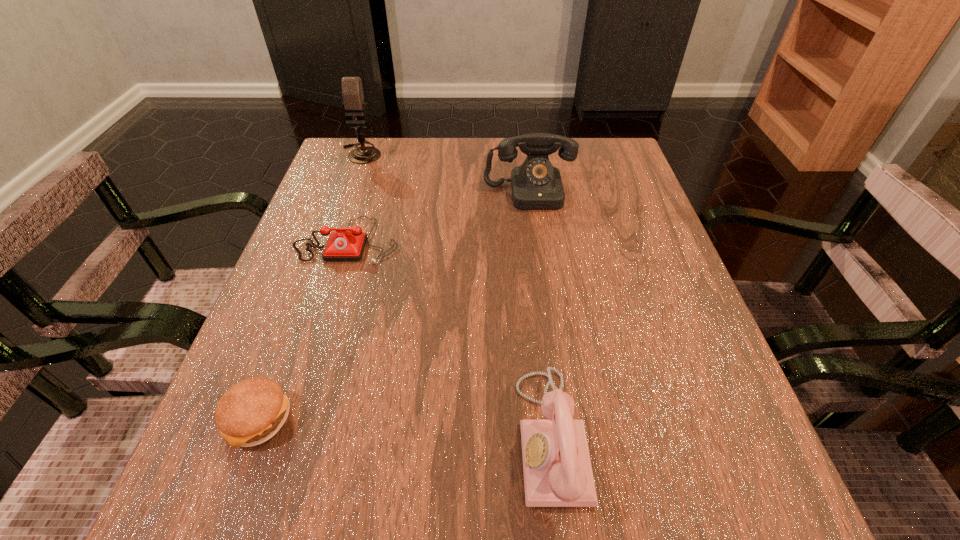
This screenshot has width=960, height=540. Identify the location of hamburger that is at the left edge. (251, 412).

Locate an element on the screen. The height and width of the screenshot is (540, 960). object situated at the right edge is located at coordinates (536, 185).

The width and height of the screenshot is (960, 540). In order to click on object at the far left corner in this screenshot , I will do `click(352, 91)`.

Find the location of a particular element. object positioned at the far right corner is located at coordinates (536, 185).

You are a GUI agent. You are given a task and a screenshot of the screen. Output one action in this format:
    pyautogui.click(x=<x>, y=<y>)
    Task: Click on the vacant position at the near edge of the desktop
    
    Given the screenshot: What is the action you would take?
    pyautogui.click(x=533, y=530)

You are a GUI agent. You are given a task and a screenshot of the screen. Output one action in this format:
    pyautogui.click(x=<x>, y=<y>)
    Task: Click on the vacant space at the left edge of the desktop
    The image size is (960, 540).
    Given the screenshot: What is the action you would take?
    click(x=341, y=194)

I want to click on free location at the right edge, so click(x=672, y=280).

This screenshot has width=960, height=540. Identify the location of free location at the far left corner of the desktop. (396, 151).

Find the location of a particular element. This screenshot has height=540, width=960. free space at the far right corner of the desktop is located at coordinates (598, 138).

You are a GUI agent. You are given a task and a screenshot of the screen. Output one action in this format:
    pyautogui.click(x=<x>, y=<y>)
    Task: Click on the vacant space that's between the hamburger and the second farthest object
    This screenshot has height=540, width=960.
    Given the screenshot: What is the action you would take?
    pyautogui.click(x=394, y=306)